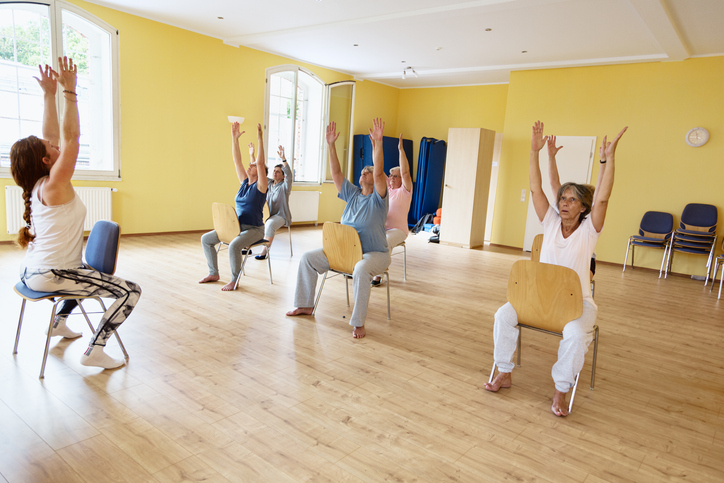
The width and height of the screenshot is (724, 483). What are the coordinates of `chairs with people sitting in them` in the screenshot? It's located at (281, 214), (247, 237), (358, 263), (405, 227), (525, 316), (75, 274).